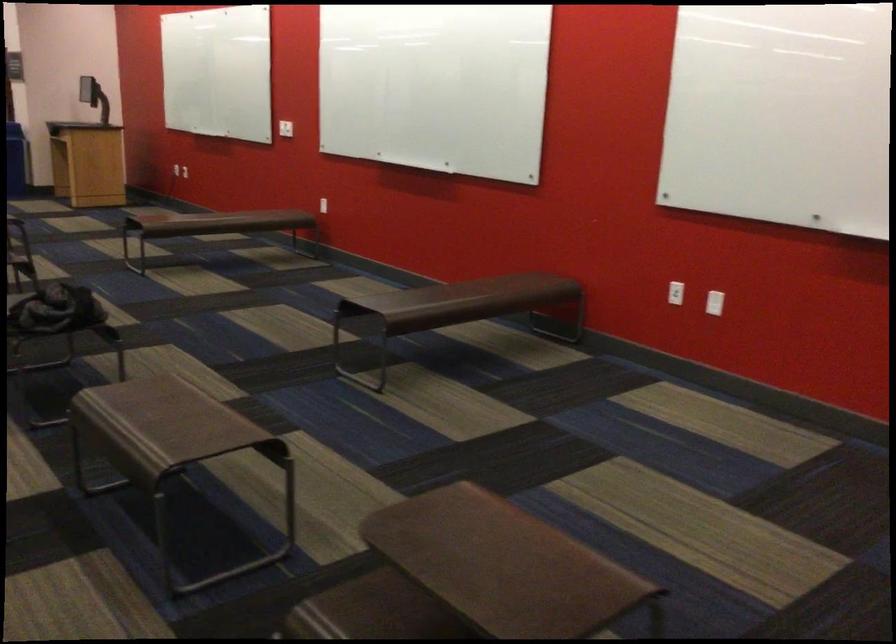
The image size is (896, 644). Describe the element at coordinates (713, 303) in the screenshot. I see `the white light switch` at that location.